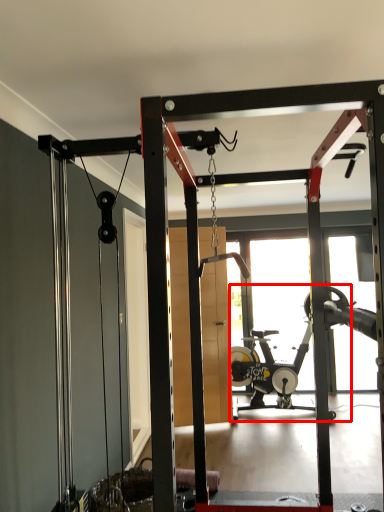
Question: In this image, where is stationary bicycle (annotated by the red box) located relative to garage door?

Choices:
 (A) left
 (B) right

Answer: (B)